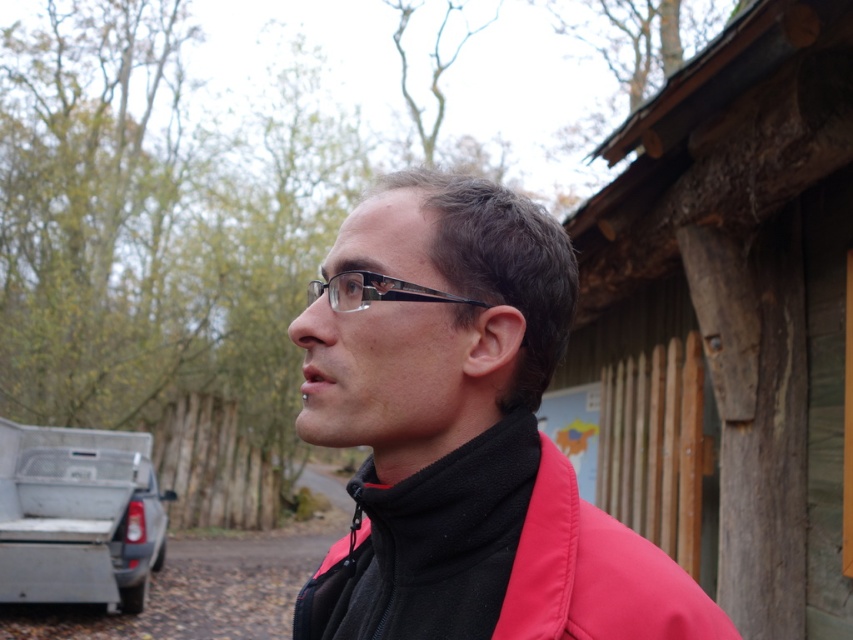
The height and width of the screenshot is (640, 853). What are the coordinates of `pink matte jacket at center` in the screenshot? It's located at (466, 438).

Which is in front, point (517, 348) or point (148, 499)?

Point (517, 348)

Is point (410, 586) closer to viewer compared to point (103, 593)?

Yes, it is in front of point (103, 593).

Identify the location of pink matte jacket at center. This screenshot has height=640, width=853. (466, 438).

Is pink fleece jacket at center positioned in front of black plastic glasses at center?

Yes, it is.

Between pink fleece jacket at center and black plastic glasses at center, which one has more height?

pink fleece jacket at center is taller.

Where is `pink fleece jacket at center`? The width and height of the screenshot is (853, 640). pink fleece jacket at center is located at coordinates (497, 556).

Locate an element on the screen. The width and height of the screenshot is (853, 640). pink fleece jacket at center is located at coordinates (497, 556).

Which of these two, wooden at right or black plastic glasses at center, stands taller?

With more height is wooden at right.

Can you confirm if wooden at right is positioned above black plastic glasses at center?

No.

This screenshot has width=853, height=640. I want to click on wooden at right, so click(x=733, y=316).

The width and height of the screenshot is (853, 640). I want to click on wooden at right, so (x=733, y=316).